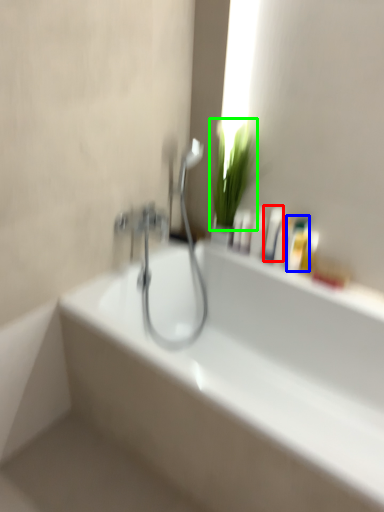
Question: Based on their relative distances, which object is nearer to mouthwash (highlighted by a red box)? Choose from mouthwash (highlighted by a blue box) and plant (highlighted by a green box).

Choices:
 (A) mouthwash
 (B) plant

Answer: (A)